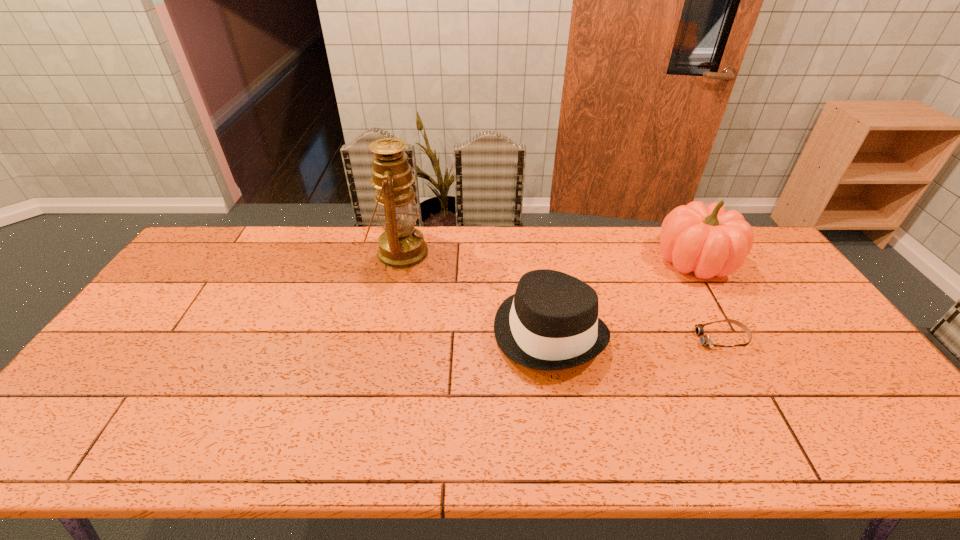
The width and height of the screenshot is (960, 540). What are the coordinates of `vacant space located 0.310m on the front-facing side of the goggles` in the screenshot? It's located at pyautogui.click(x=586, y=339).

Image resolution: width=960 pixels, height=540 pixels. Find the location of `free region located on the front-facing side of the goggles`. free region located on the front-facing side of the goggles is located at coordinates (640, 339).

What are the coordinates of `oil lamp that is at the far edge` in the screenshot? It's located at (401, 246).

Locate an element on the screen. The width and height of the screenshot is (960, 540). pumpkin present at the far edge is located at coordinates (709, 241).

Locate an element on the screen. The width and height of the screenshot is (960, 540). object that is at the right edge is located at coordinates (709, 241).

At what (x,y) coordinates should I click in order to perform the action: click on object at the far right corner. Please return your answer as a coordinate pair (x, y). Looking at the image, I should click on (709, 241).

Identify the location of free space at the far edge of the desktop. The width and height of the screenshot is (960, 540). (516, 264).

The image size is (960, 540). What are the coordinates of `free space at the near edge of the desktop` in the screenshot? It's located at (332, 440).

Where is `free space at the left edge`? This screenshot has height=540, width=960. free space at the left edge is located at coordinates (134, 401).

At what (x,y) coordinates should I click in order to perform the action: click on free space at the right edge of the desktop. Please return your answer as a coordinate pair (x, y). This screenshot has height=540, width=960. Looking at the image, I should click on (749, 278).